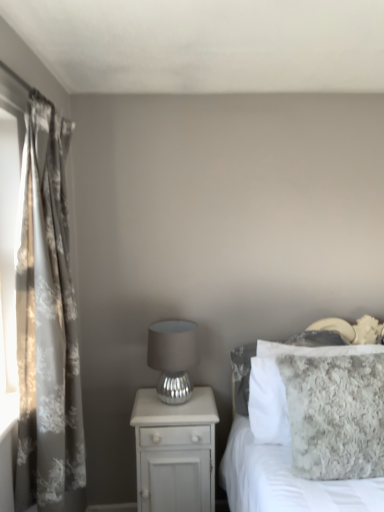
Question: Considering the positions of fuzzy gray blanket at right and matte silver table lamp at center in the image, is fuzzy gray blanket at right wider or thinner than matte silver table lamp at center?

Choices:
 (A) thin
 (B) wide

Answer: (B)

Question: Which is correct: fuzzy gray blanket at right is inside matte silver table lamp at center, or outside of it?

Choices:
 (A) outside
 (B) inside

Answer: (A)

Question: Which of these objects is positioned closest to the white glossy nightstand at lower left?

Choices:
 (A) fuzzy gray blanket at right
 (B) matte silver table lamp at center
 (C) floral-patterned fabric curtain at left

Answer: (B)

Question: Which of these objects is positioned farthest from the floral-patterned fabric curtain at left?

Choices:
 (A) matte silver table lamp at center
 (B) white glossy nightstand at lower left
 (C) fuzzy gray blanket at right

Answer: (C)